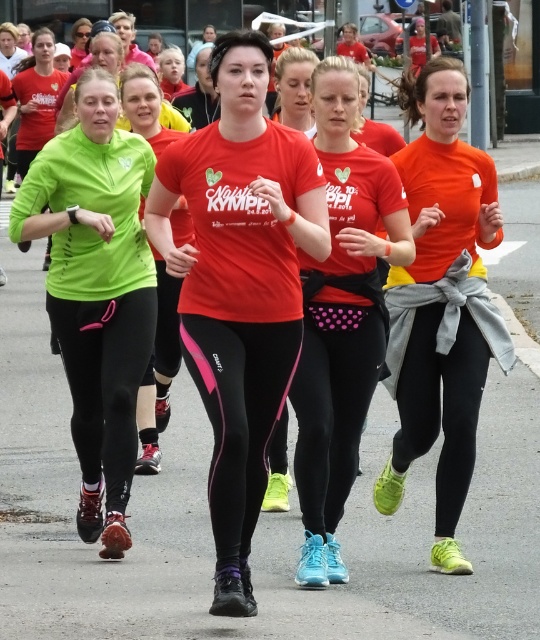
Question: Which of the following is the closest to the observer?

Choices:
 (A) (429, 256)
 (B) (310, 365)

Answer: (B)

Question: Is green matte leggings at left above matte orange shirt at center?

Choices:
 (A) yes
 (B) no

Answer: (B)

Question: Which object is closer to the camera taking this photo?

Choices:
 (A) green matte leggings at center
 (B) matte red shirt at center
 (C) matte orange shirt at center

Answer: (B)

Question: Is matte orange shirt at center to the left of pink dotted leggings at center from the viewer's perspective?

Choices:
 (A) yes
 (B) no

Answer: (B)

Question: Observing the image, what is the correct spatial positioning of matte red shirt at center in reference to green matte leggings at left?

Choices:
 (A) below
 (B) above

Answer: (A)

Question: Which of the following is the farthest from the observer?

Choices:
 (A) green matte leggings at left
 (B) pink dotted leggings at center

Answer: (A)